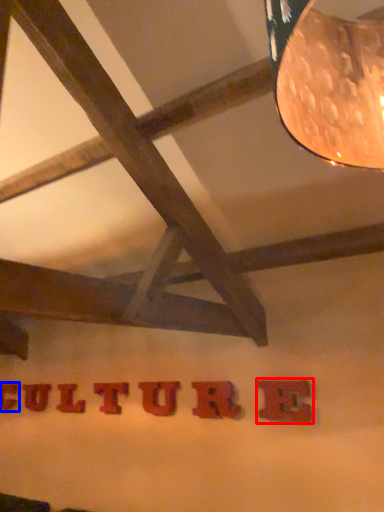
Question: Which object is closer to the camera taking this photo, letter (highlighted by a red box) or letter (highlighted by a blue box)?

Choices:
 (A) letter
 (B) letter

Answer: (A)